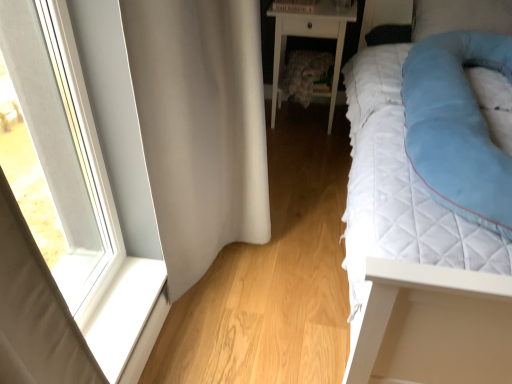
Image resolution: width=512 pixels, height=384 pixels. What are the coordinates of `vacant area on top of white smooth window sill at lower left (from a real-world perspective)` in the screenshot? It's located at (121, 310).